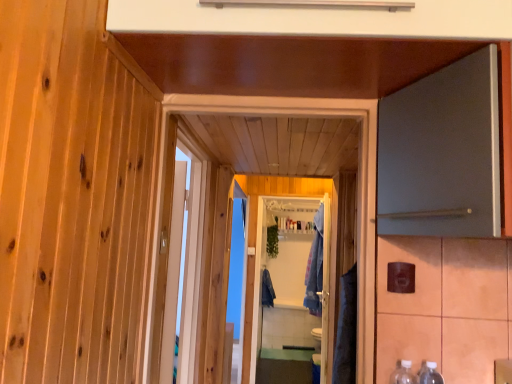
Question: Is clear plastic bottles at lower right, which is counted as the first bottle, starting from the left, smaller than white glossy screen door at center?

Choices:
 (A) yes
 (B) no

Answer: (A)

Question: Is clear plastic bottles at lower right, which is counted as the first bottle, starting from the left, thinner than white glossy screen door at center?

Choices:
 (A) no
 (B) yes

Answer: (A)

Question: From the image's perspective, is clear plastic bottles at lower right, arranged as the second bottle when viewed from the right, beneath white glossy screen door at center?

Choices:
 (A) no
 (B) yes

Answer: (A)

Question: Is the position of clear plastic bottles at lower right, arranged as the second bottle when viewed from the right, more distant than that of white glossy screen door at center?

Choices:
 (A) no
 (B) yes

Answer: (A)

Question: Is clear plastic bottles at lower right, arranged as the second bottle when viewed from the right, at the left side of white glossy screen door at center?

Choices:
 (A) no
 (B) yes

Answer: (A)

Question: From a real-world perspective, is clear plastic bottles at lower right, arranged as the second bottle when viewed from the right, located higher than white glossy screen door at center?

Choices:
 (A) no
 (B) yes

Answer: (B)

Question: Is clear plastic bottles at lower right, positioned as the second bottle in left-to-right order, placed right next to white wooden door at center, marked as the second door in a right-to-left arrangement?

Choices:
 (A) no
 (B) yes

Answer: (A)

Question: Considering the relative sizes of clear plastic bottles at lower right, positioned as the second bottle in left-to-right order, and white wooden door at center, positioned as the 1th door in left-to-right order, in the image provided, is clear plastic bottles at lower right, positioned as the second bottle in left-to-right order, shorter than white wooden door at center, positioned as the 1th door in left-to-right order,?

Choices:
 (A) no
 (B) yes

Answer: (B)

Question: Is clear plastic bottles at lower right, which is the first bottle from right to left, wider than white wooden door at center, marked as the second door in a right-to-left arrangement?

Choices:
 (A) yes
 (B) no

Answer: (A)

Question: Is clear plastic bottles at lower right, which is the first bottle from right to left, to the left of white wooden door at center, positioned as the 1th door in left-to-right order, from the viewer's perspective?

Choices:
 (A) no
 (B) yes

Answer: (A)

Question: From the image's perspective, is clear plastic bottles at lower right, which is the first bottle from right to left, located beneath white wooden door at center, positioned as the 1th door in left-to-right order?

Choices:
 (A) no
 (B) yes

Answer: (B)

Question: Is clear plastic bottles at lower right, positioned as the second bottle in left-to-right order, oriented away from white wooden door at center, marked as the second door in a right-to-left arrangement?

Choices:
 (A) no
 (B) yes

Answer: (A)

Question: Is white glossy screen door at center at the right side of denim robe at center, the second robe in the left-to-right sequence?

Choices:
 (A) no
 (B) yes

Answer: (A)